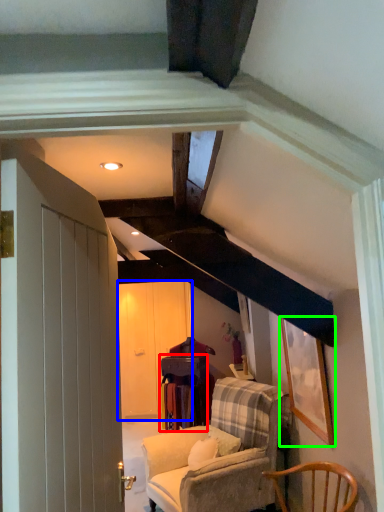
Question: Considering the real-world distances, which object is farthest from table (highlighted by a red box)? glass door (highlighted by a blue box) or picture frame (highlighted by a green box)?

Choices:
 (A) glass door
 (B) picture frame

Answer: (B)